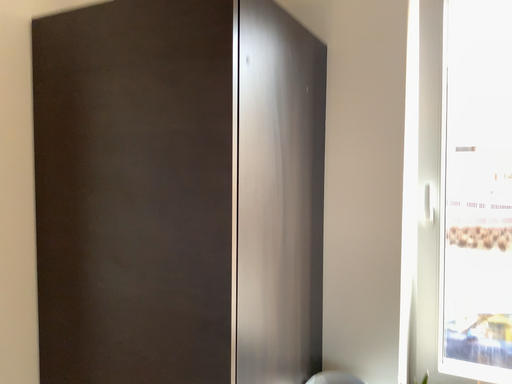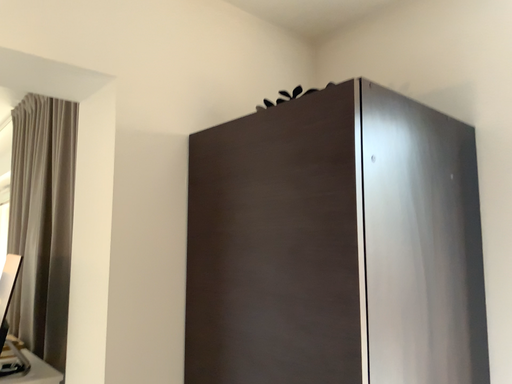
Question: How did the camera likely rotate when shooting the video?

Choices:
 (A) rotated left
 (B) rotated right

Answer: (A)